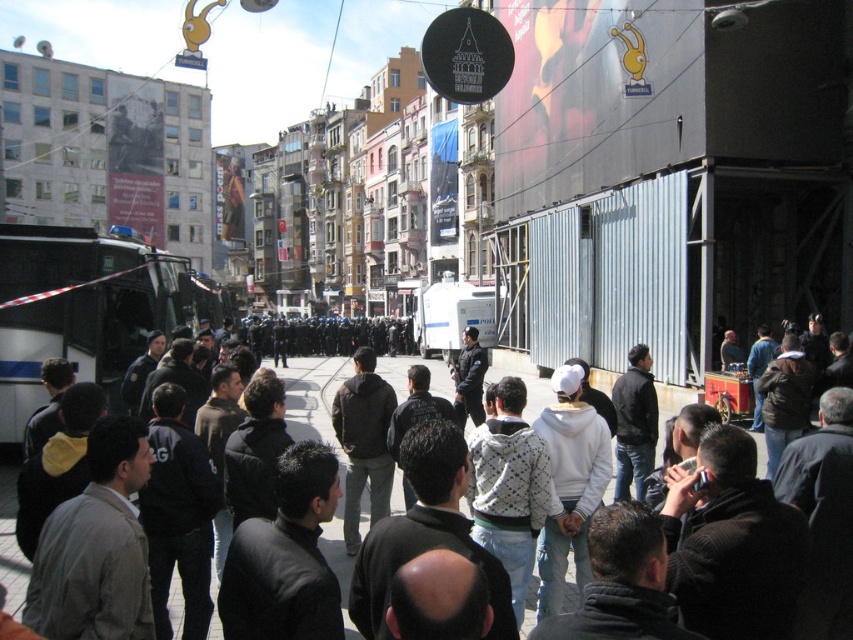
You are a pedestrian standing on the street and see the brushed metal bus at left and the dark gray jacket at center. Which object is closer to you?

The brushed metal bus at left is closer to you because the dark gray jacket at center is behind it, meaning the bus is in front.

You are standing in the middle of the bustling city street shown in the image. There are two points marked on the ground in front of you. The first point is at coordinates point [3,266], and the second point is at coordinates point [175,634]. Which point is closer to your current position?

Point [3,266] is closer to your current position because it is further to the camera than point [175,634], meaning it is physically nearer to where you are standing.

You are a pedestrian standing on the sidewalk in this city scene. You want to cross the street to reach a store located behind the dark gray jacket at center. Is the brushed metal bus at left blocking your path?

The brushed metal bus at left is above the dark gray jacket at center, so it is positioned higher in the image but not necessarily blocking the path. However, since the bus is at the left and the jacket is at the center, the bus might be to the side rather than directly in front. Therefore, the path to the store behind the dark gray jacket at center is likely not blocked by the bus.